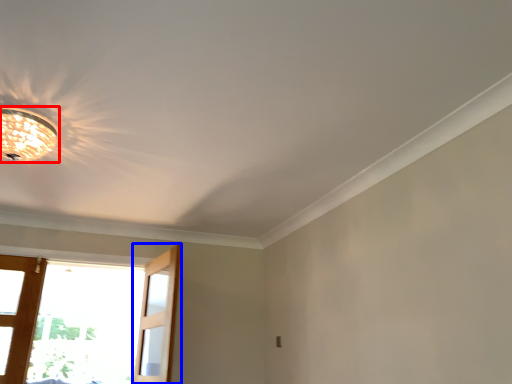
Question: Which object appears farthest to the camera in this image, lamp (highlighted by a red box) or screen door (highlighted by a blue box)?

Choices:
 (A) lamp
 (B) screen door

Answer: (B)